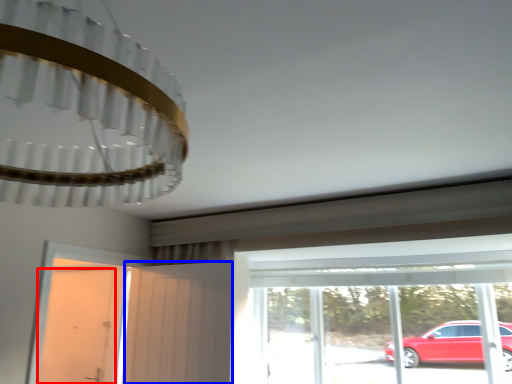
Question: Which object is further to the camera taking this photo, door (highlighted by a red box) or screen door (highlighted by a blue box)?

Choices:
 (A) door
 (B) screen door

Answer: (A)